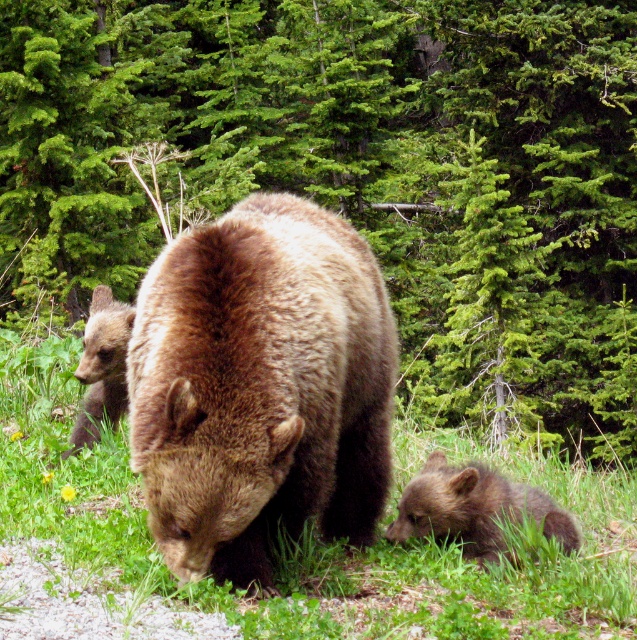
Question: Is brown furry bear at center below green soft grass at center?

Choices:
 (A) no
 (B) yes

Answer: (A)

Question: Among these objects, which one is farthest from the camera?

Choices:
 (A) brown furry bear at lower right
 (B) green soft grass at center
 (C) green evergreen tree at center
 (D) brown fuzzy bear cub at left

Answer: (C)

Question: Considering the relative positions of green evergreen tree at center and brown furry bear at lower right in the image provided, where is green evergreen tree at center located with respect to brown furry bear at lower right?

Choices:
 (A) left
 (B) right

Answer: (A)

Question: Which object is positioned farthest from the brown furry bear at center?

Choices:
 (A) brown furry bear at lower right
 (B) green soft grass at center
 (C) brown fuzzy bear cub at left

Answer: (C)

Question: Which object is positioned closest to the brown furry bear at center?

Choices:
 (A) green soft grass at center
 (B) brown furry bear at lower right
 (C) green evergreen tree at center
 (D) brown fuzzy bear cub at left

Answer: (B)

Question: Can you confirm if green evergreen tree at center is wider than brown furry bear at center?

Choices:
 (A) yes
 (B) no

Answer: (A)